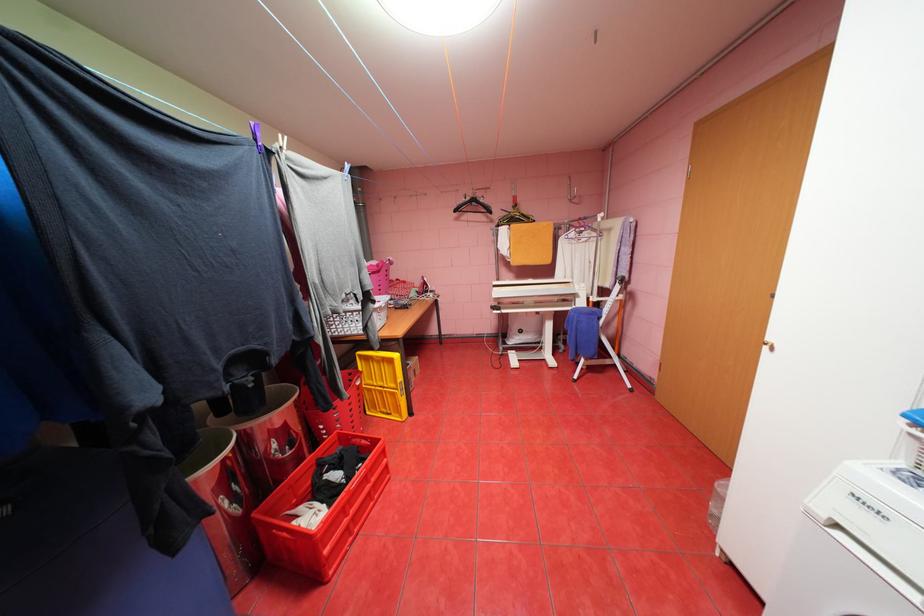
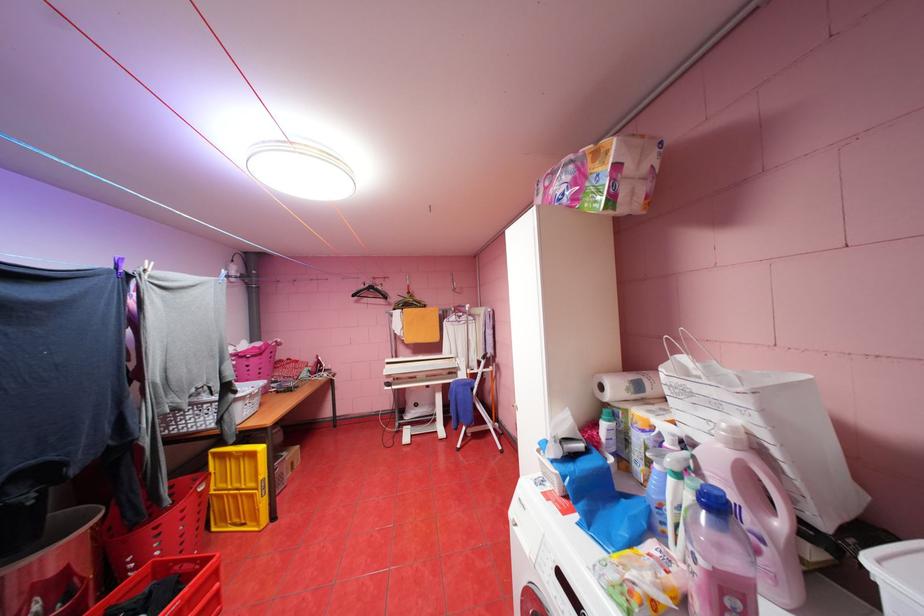
Where in the second image is the point corresponding to (370,355) from the first image?

(224, 454)